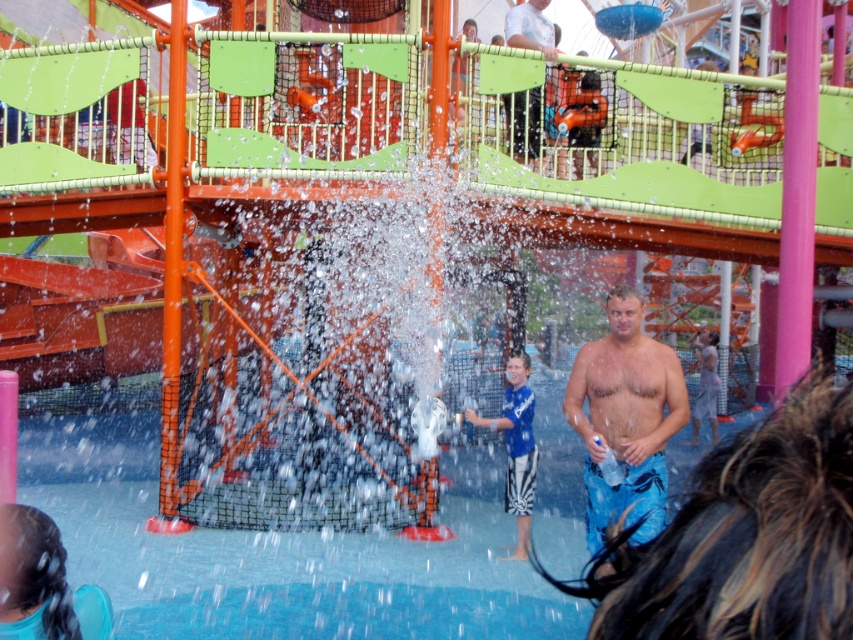
Which is below, blue fabric hair at lower left or smooth white shirt at upper center?

blue fabric hair at lower left

Is blue fabric hair at lower left smaller than smooth white shirt at upper center?

No, blue fabric hair at lower left is not smaller than smooth white shirt at upper center.

Locate an element on the screen. The image size is (853, 640). blue fabric hair at lower left is located at coordinates (42, 582).

The width and height of the screenshot is (853, 640). In order to click on blue fabric hair at lower left in this screenshot , I will do `click(42, 582)`.

Does blue rubber pool at center have a larger size compared to smooth white shirt at upper center?

Indeed, blue rubber pool at center has a larger size compared to smooth white shirt at upper center.

In the scene shown: Who is more forward, (x=120, y=580) or (x=519, y=157)?

Point (x=120, y=580)

This screenshot has width=853, height=640. Identify the location of blue rubber pool at center. (280, 552).

Who is more forward, (582,401) or (33,595)?

Point (33,595)

Does blue swim trunks at center come in front of blue fabric hair at lower left?

Yes, blue swim trunks at center is in front of blue fabric hair at lower left.

Is point (608, 317) behind point (39, 588)?

Yes, it is.

This screenshot has height=640, width=853. Find the location of `blue swim trunks at center`. blue swim trunks at center is located at coordinates (625, 419).